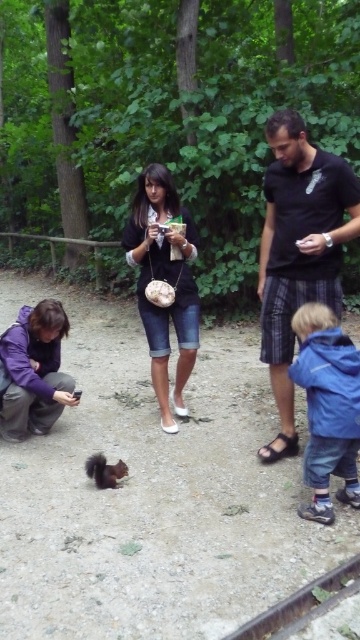
Question: Can you confirm if black cotton shirt at center is wider than shiny brown fur at lower left?

Choices:
 (A) no
 (B) yes

Answer: (B)

Question: From the image, what is the correct spatial relationship of denim shorts at center in relation to shiny brown fur at lower left?

Choices:
 (A) above
 (B) below

Answer: (A)

Question: Which of the following is the farthest from the observer?

Choices:
 (A) blue fleece jacket at lower right
 (B) shiny brown fur at lower left
 (C) black cotton shirt at center
 (D) purple fabric jacket at lower left

Answer: (D)

Question: Which of these objects is positioned farthest from the blue fleece jacket at lower right?

Choices:
 (A) black cotton shirt at center
 (B) purple fabric jacket at lower left
 (C) shiny brown fur at lower left
 (D) denim shorts at center

Answer: (B)

Question: Can you confirm if black cotton shirt at center is bigger than blue fleece jacket at lower right?

Choices:
 (A) yes
 (B) no

Answer: (A)

Question: Which object is positioned farthest from the shiny brown fur at lower left?

Choices:
 (A) purple fabric jacket at lower left
 (B) black cotton shirt at center
 (C) blue fleece jacket at lower right

Answer: (B)